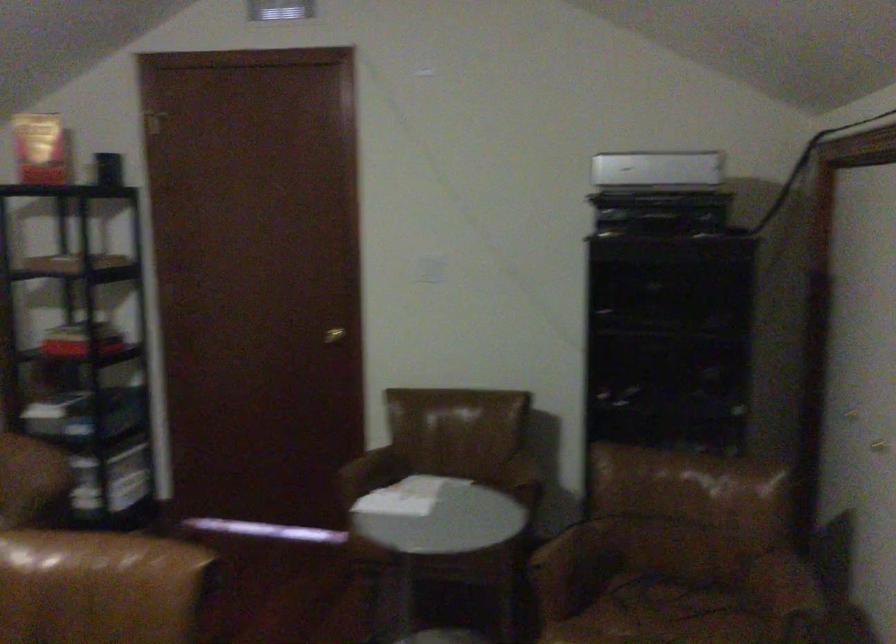
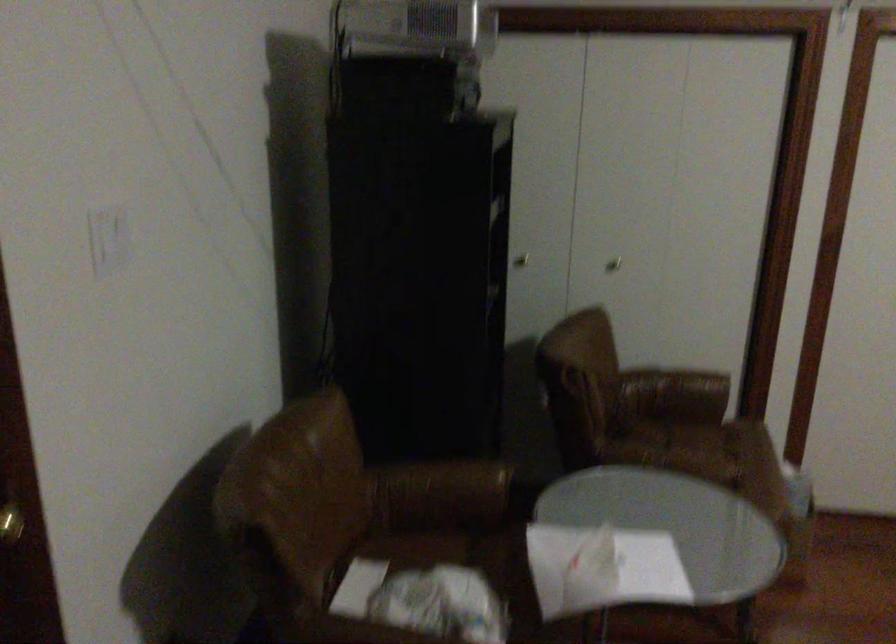
The point at [607,172] is marked in the first image. Where is the corresponding point in the second image?

(412, 26)